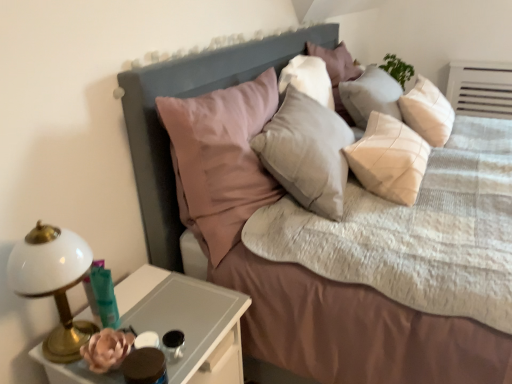
The height and width of the screenshot is (384, 512). Identify the location of vacant space behind black glass candle holder at lower left, arranged as the second candle holder when viewed from the left. (184, 315).